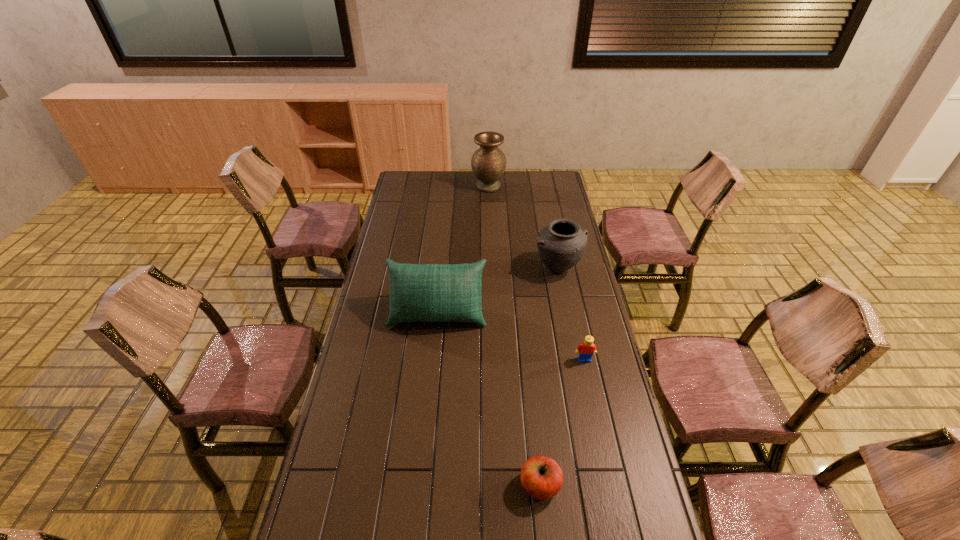
Image resolution: width=960 pixels, height=540 pixels. Identify the location of the tallest object. (488, 163).

Locate an element on the screen. The image size is (960, 540). the farthest object is located at coordinates 488,163.

This screenshot has height=540, width=960. What are the coordinates of `urn` in the screenshot? It's located at (561, 244).

At what (x,y) coordinates should I click in order to perform the action: click on the third nearest object. Please return your answer as a coordinate pair (x, y). This screenshot has height=540, width=960. Looking at the image, I should click on (429, 292).

Identify the location of Lego. The image size is (960, 540). (587, 348).

Identify the location of apple. (541, 477).

Locate an element on the screen. The height and width of the screenshot is (540, 960). blank area located 0.190m on the front of the farthest object is located at coordinates (490, 216).

Identify the location of vacant region located 0.290m on the front of the urn. (572, 338).

At what (x,y) coordinates should I click in order to perform the action: click on free space located 0.200m on the front-facing side of the cushion. Please return your answer as a coordinate pair (x, y). The image size is (960, 540). Looking at the image, I should click on [431, 378].

Image resolution: width=960 pixels, height=540 pixels. I want to click on vacant region located on the face of the second nearest object, so click(588, 377).